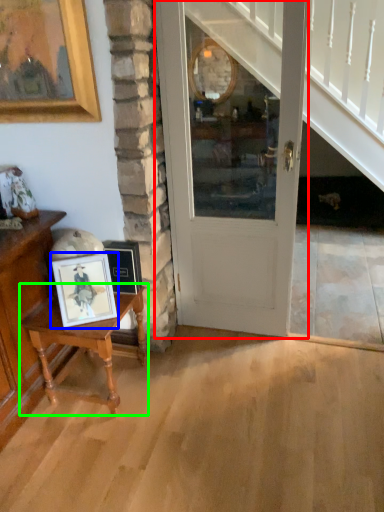
Question: Which is farther away from door (highlighted by a red box)? picture frame (highlighted by a blue box) or table (highlighted by a green box)?

Choices:
 (A) picture frame
 (B) table

Answer: (A)